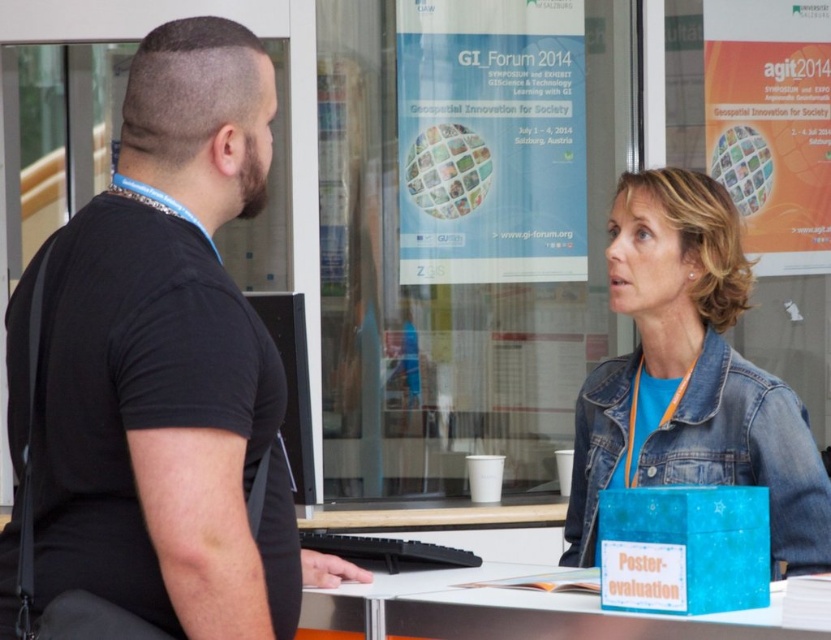
Measure the distance between point (x=21, y=477) and camera.

Point (x=21, y=477) and camera are 2.03 meters apart from each other.

Find the location of `black matte shirt at left`. black matte shirt at left is located at coordinates (170, 364).

Does denim jacket at lower right have a greater width compared to blue plastic table at lower center?

Incorrect, denim jacket at lower right's width does not surpass blue plastic table at lower center's.

Who is more distant from viewer, (573, 506) or (549, 609)?

The point (573, 506) is more distant.

Is point (692, 378) positioned in front of point (494, 636)?

No, it is behind (494, 636).

I want to click on denim jacket at lower right, so click(746, 451).

Which is above, black matte shirt at left or denim jacket at lower right?

black matte shirt at left is above.

Based on the photo, does black matte shirt at left have a lesser width compared to denim jacket at lower right?

Yes.

You are a GUI agent. You are given a task and a screenshot of the screen. Output one action in this format:
    pyautogui.click(x=<x>, y=<y>)
    Task: Click on the black matte shirt at left
    The image size is (831, 640).
    Given the screenshot: What is the action you would take?
    pyautogui.click(x=170, y=364)